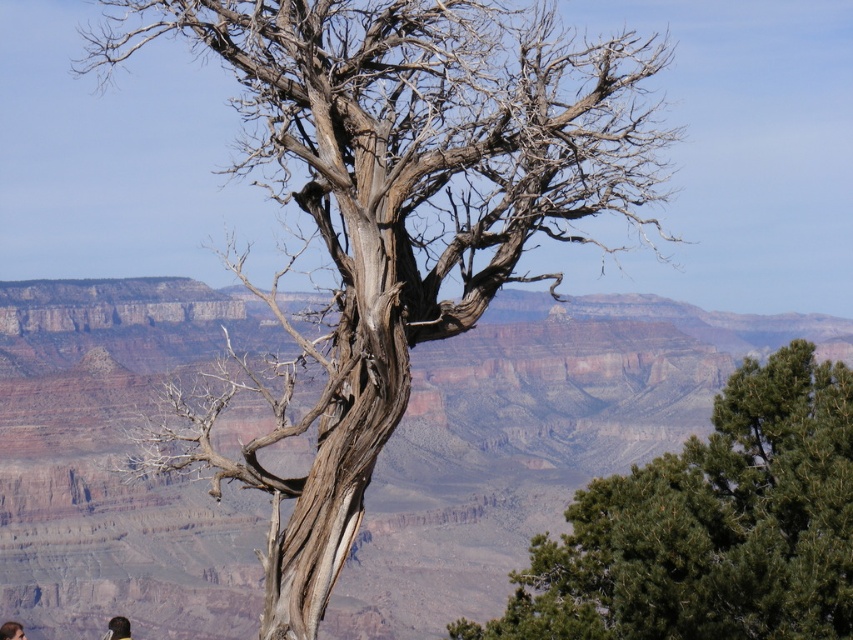
Is gray bark tree at center wider than dark brown hair at lower left?

Indeed, gray bark tree at center has a greater width compared to dark brown hair at lower left.

Is point (318, 410) positioned after point (7, 637)?

No, it is not.

Is point (456, 140) in front of point (3, 625)?

Yes, it is in front of point (3, 625).

This screenshot has width=853, height=640. I want to click on gray bark tree at center, so click(401, 205).

Is black fabric head at lower left further to the viewer compared to dark brown hair at lower left?

No, black fabric head at lower left is in front of dark brown hair at lower left.

Describe the element at coordinates (117, 628) in the screenshot. I see `black fabric head at lower left` at that location.

What do you see at coordinates (117, 628) in the screenshot? I see `black fabric head at lower left` at bounding box center [117, 628].

At what (x,y) coordinates should I click in order to perform the action: click on black fabric head at lower left. Please return your answer as a coordinate pair (x, y). The image size is (853, 640). Looking at the image, I should click on (117, 628).

Is gray bark tree at center smaller than green textured pine tree at center?

No.

Is gray bark tree at center to the left of green textured pine tree at center from the viewer's perspective?

Yes, gray bark tree at center is to the left of green textured pine tree at center.

Where is `gray bark tree at center`? gray bark tree at center is located at coordinates (401, 205).

You are a GUI agent. You are given a task and a screenshot of the screen. Output one action in this format:
    pyautogui.click(x=<x>, y=<y>)
    Task: Click on the gray bark tree at center
    The height and width of the screenshot is (640, 853).
    Given the screenshot: What is the action you would take?
    pyautogui.click(x=401, y=205)